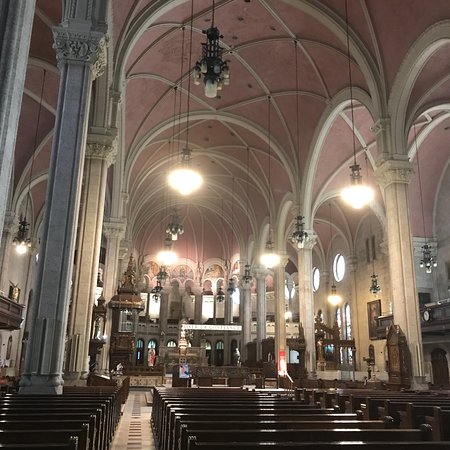
Locate an element on the screen. This screenshot has width=450, height=450. pendant lights is located at coordinates (20, 247), (184, 179), (167, 257), (267, 259), (354, 194).